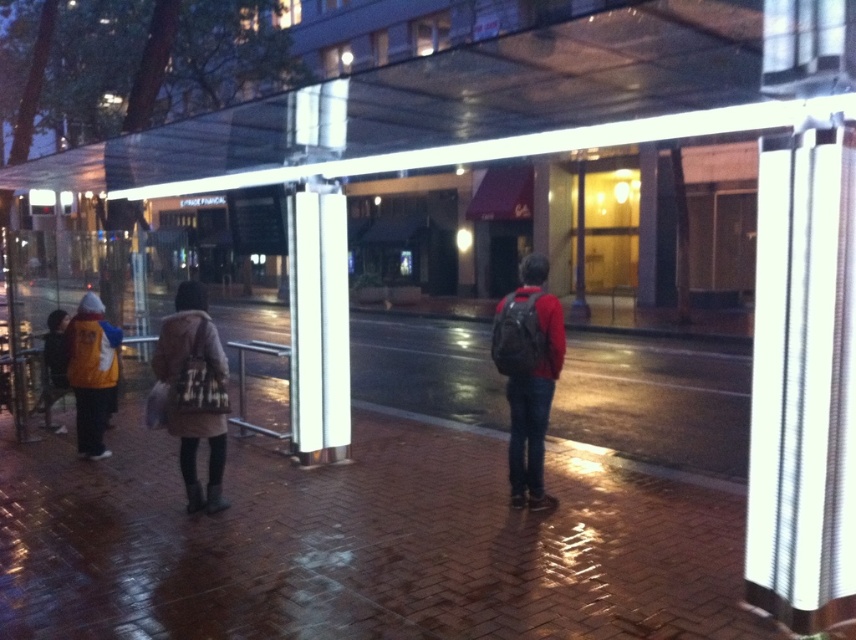
Does brown fuzzy coat at center have a larger size compared to yellow jacket at left?

Yes.

Is brown fuzzy coat at center wider than yellow jacket at left?

Yes.

Where is `brown fuzzy coat at center`? This screenshot has height=640, width=856. brown fuzzy coat at center is located at coordinates (192, 392).

This screenshot has width=856, height=640. In order to click on brown fuzzy coat at center in this screenshot , I will do `click(192, 392)`.

Does point (513, 380) lie in front of point (52, 401)?

Yes, it is in front of point (52, 401).

From the picture: Measure the distance between point (539, 369) and camera.

Point (539, 369) is 5.30 meters from camera.

The height and width of the screenshot is (640, 856). I want to click on matte black backpack at center, so click(528, 376).

Consider the image. Can you confirm if brown fuzzy coat at center is positioned to the right of matte yellow jacket at left?

Correct, you'll find brown fuzzy coat at center to the right of matte yellow jacket at left.

Between point (217, 490) and point (58, 339), which one is positioned behind?

Positioned behind is point (58, 339).

This screenshot has width=856, height=640. What are the coordinates of `brown fuzzy coat at center` in the screenshot? It's located at (192, 392).